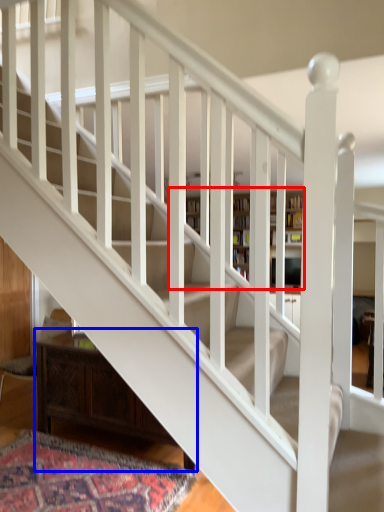
Question: Which point is closer to the camera, bookcase (highlighted by a red box) or furniture (highlighted by a blue box)?

Choices:
 (A) bookcase
 (B) furniture

Answer: (B)